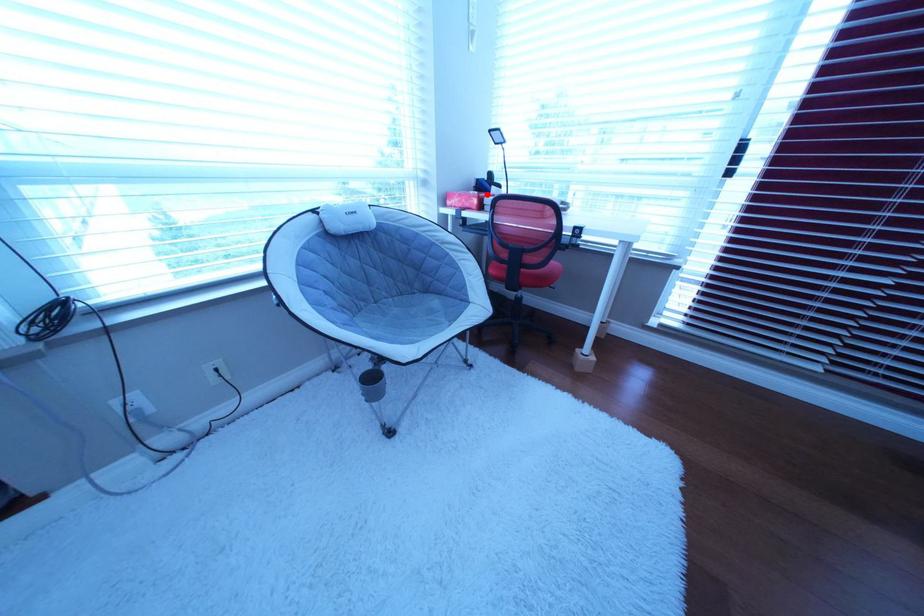
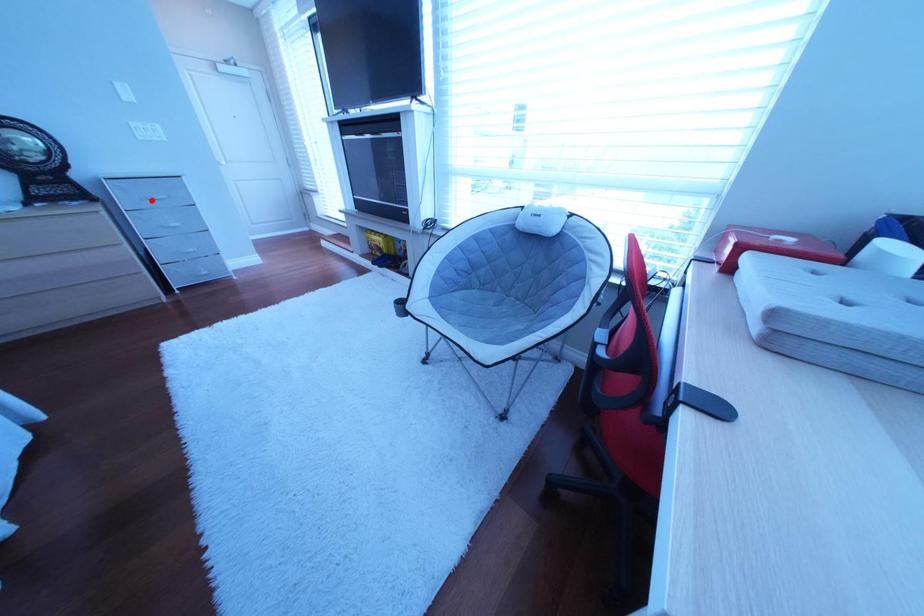
I am providing you with two images of the same scene from different viewpoints. A red point is marked on the first image and another point is marked on the second image. Do the highlighted points in image1 and image2 indicate the same real-world spot?

No